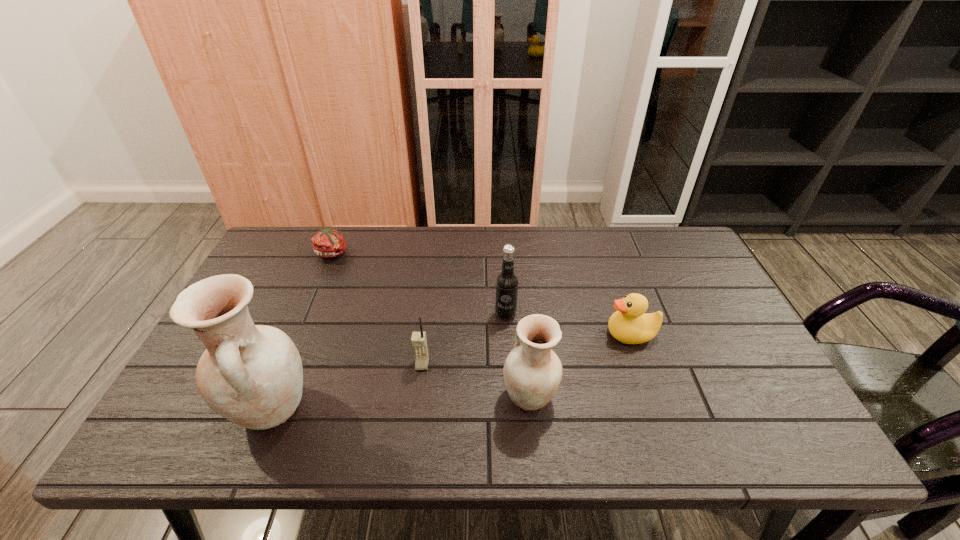
Identify the location of free point that keeps the potterys evenly spaced on the right. The width and height of the screenshot is (960, 540). (775, 383).